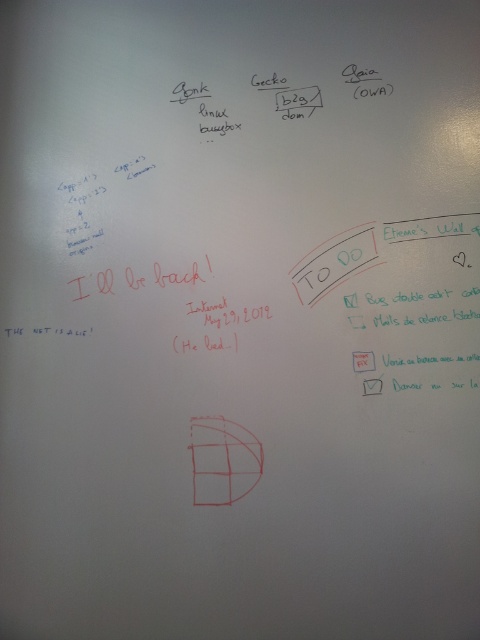
You are a GUI agent. You are given a task and a screenshot of the screen. Output one action in this format:
    pyautogui.click(x=<x>, y=<y>)
    Task: Click on the green marker text at center
    Image resolution: width=480 pixels, height=640 pixels.
    Given the screenshot: What is the action you would take?
    pyautogui.click(x=334, y=262)

Is green marker text at center thinner than white paper at center?

In fact, green marker text at center might be wider than white paper at center.

Is point (359, 259) less distant than point (354, 356)?

No, (359, 259) is further to viewer.

The height and width of the screenshot is (640, 480). I want to click on green marker text at center, so [334, 262].